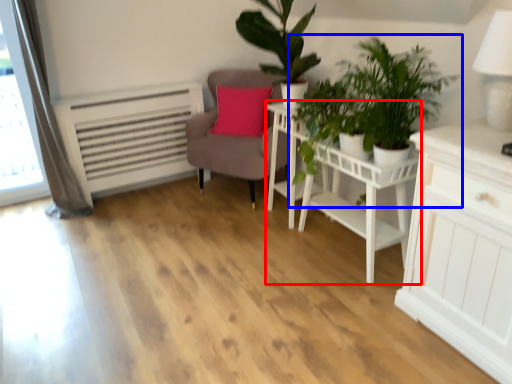
Question: Which object appears closest to the camera in this image, table (highlighted by a red box) or houseplant (highlighted by a blue box)?

Choices:
 (A) table
 (B) houseplant

Answer: (B)